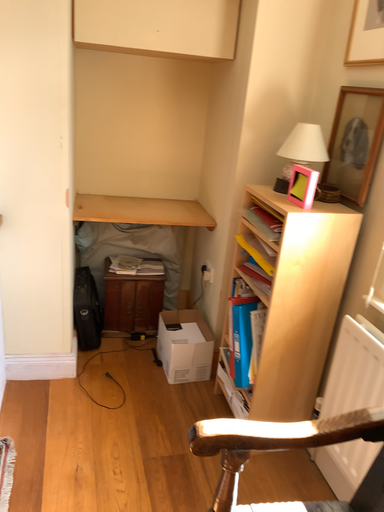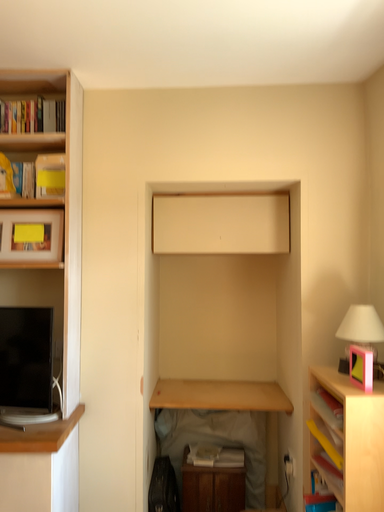
Question: How did the camera likely rotate when shooting the video?

Choices:
 (A) rotated upward
 (B) rotated downward

Answer: (A)